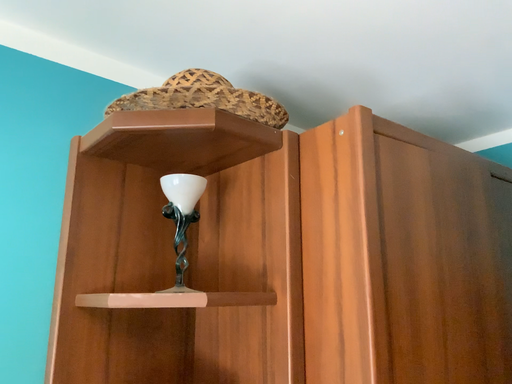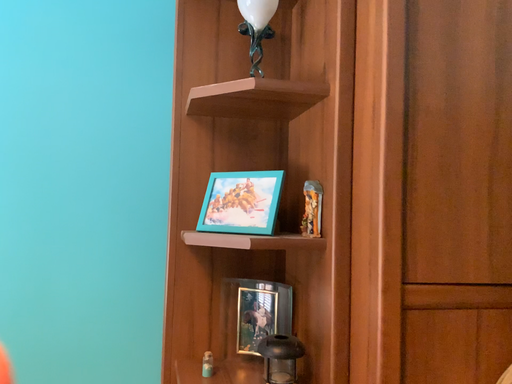
Question: Which way did the camera rotate in the video?

Choices:
 (A) rotated upward
 (B) rotated downward

Answer: (B)